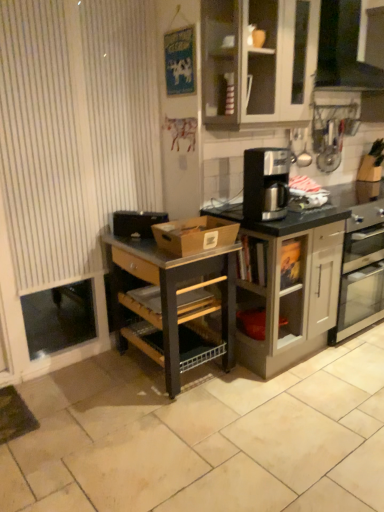
Question: Does brown cardboard box at center have a lesser width compared to black plastic coffee maker at center?

Choices:
 (A) yes
 (B) no

Answer: (B)

Question: Can you confirm if brown cardboard box at center is taller than black plastic coffee maker at center?

Choices:
 (A) yes
 (B) no

Answer: (B)

Question: Is brown cardboard box at center aimed at black plastic coffee maker at center?

Choices:
 (A) no
 (B) yes

Answer: (A)

Question: Is brown cardboard box at center wider than black plastic coffee maker at center?

Choices:
 (A) no
 (B) yes

Answer: (B)

Question: From a real-world perspective, is brown cardboard box at center under black plastic coffee maker at center?

Choices:
 (A) yes
 (B) no

Answer: (A)

Question: Does brown cardboard box at center lie behind black plastic coffee maker at center?

Choices:
 (A) yes
 (B) no

Answer: (B)

Question: From a real-world perspective, is black granite coffee maker at center beneath black matte toaster at left?

Choices:
 (A) yes
 (B) no

Answer: (A)

Question: From the image's perspective, is black granite coffee maker at center below black matte toaster at left?

Choices:
 (A) yes
 (B) no

Answer: (B)

Question: From a real-world perspective, does black granite coffee maker at center stand above black matte toaster at left?

Choices:
 (A) no
 (B) yes

Answer: (A)

Question: Is black granite coffee maker at center bigger than black matte toaster at left?

Choices:
 (A) yes
 (B) no

Answer: (A)

Question: Would you say black granite coffee maker at center is a long distance from black matte toaster at left?

Choices:
 (A) yes
 (B) no

Answer: (B)

Question: Can you confirm if black granite coffee maker at center is smaller than black matte toaster at left?

Choices:
 (A) no
 (B) yes

Answer: (A)

Question: Does matte gray cabinet at center, which is the 2th cabinetry in top-to-bottom order, have a lesser width compared to brown cardboard box at center?

Choices:
 (A) yes
 (B) no

Answer: (B)